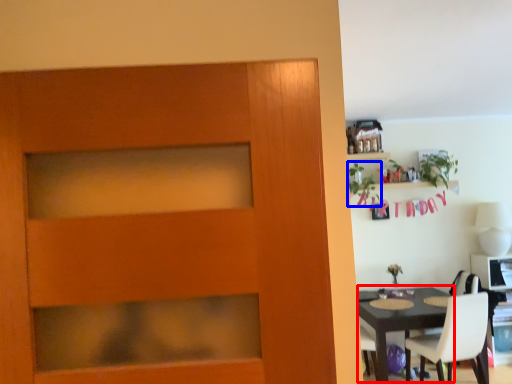
Question: Which object is closer to the camera taking this photo, round table (highlighted by a red box) or plant (highlighted by a blue box)?

Choices:
 (A) round table
 (B) plant

Answer: (A)